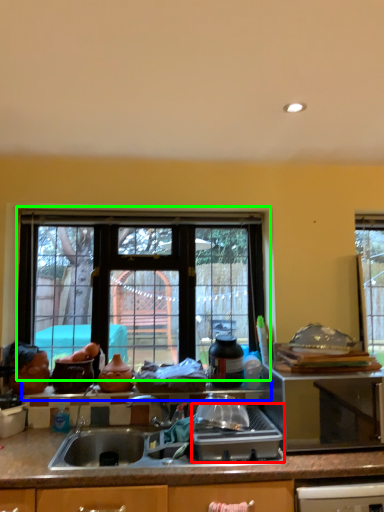
Question: Based on their relative distances, which object is farther from kitchen appliance (highlighted by a red box)? Choose from window sill (highlighted by a blue box) and window (highlighted by a green box).

Choices:
 (A) window sill
 (B) window

Answer: (B)